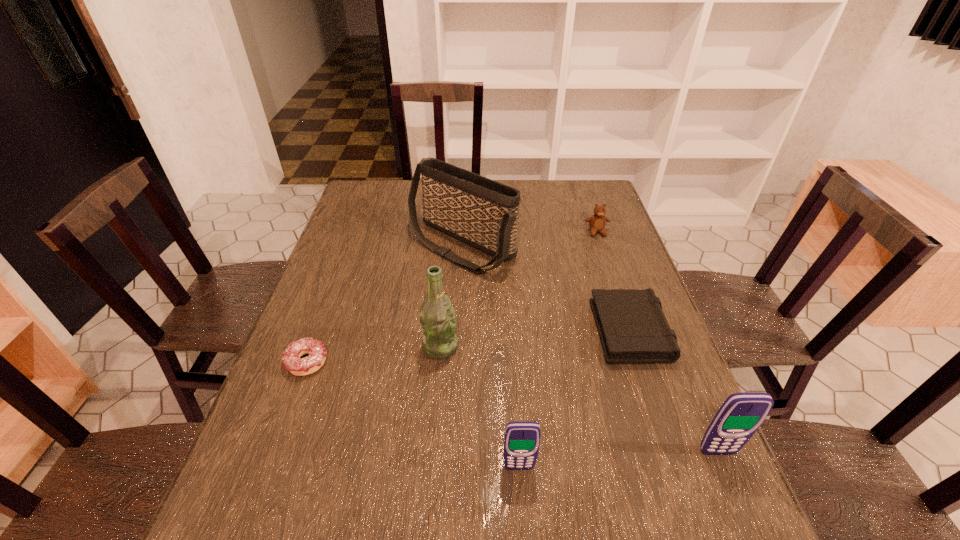
Image resolution: width=960 pixels, height=540 pixels. I want to click on vacant region at the far edge, so click(420, 213).

Locate an element on the screen. This screenshot has width=960, height=540. vacant space at the near edge of the desktop is located at coordinates (486, 451).

Where is `free space at the left edge`? The image size is (960, 540). free space at the left edge is located at coordinates (343, 238).

Where is `vacant space at the right edge of the desktop`? vacant space at the right edge of the desktop is located at coordinates (652, 405).

This screenshot has height=540, width=960. I want to click on vacant space at the far left corner of the desktop, so pos(394,204).

In the image, there is a desktop. Identify the location of free space at the near right corner. (662, 460).

At what (x,y) coordinates should I click in order to perform the action: click on vacant space in between the shortest object and the Bible. Please return your answer as a coordinate pair (x, y). Looking at the image, I should click on (468, 345).

Identify the location of vacant area between the handbag and the shortest object. (385, 303).

At what (x,y) coordinates should I click in order to perform the action: click on free area in between the nearest object and the handbag. Please return your answer as a coordinate pair (x, y). The width and height of the screenshot is (960, 540). Looking at the image, I should click on (491, 356).

What are the coordinates of `vacant area that lies between the sixth tallest object and the handbag` in the screenshot? It's located at (545, 286).